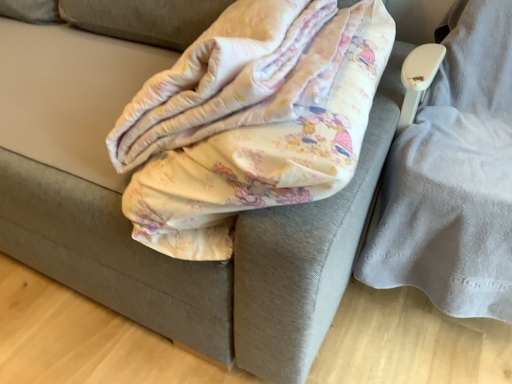
Question: Considering the relative positions of gray fabric swivel chair at right and fluffy cotton blanket at center in the image provided, is gray fabric swivel chair at right to the left of fluffy cotton blanket at center from the viewer's perspective?

Choices:
 (A) no
 (B) yes

Answer: (A)

Question: From the image's perspective, does gray fabric swivel chair at right appear lower than fluffy cotton blanket at center?

Choices:
 (A) no
 (B) yes

Answer: (B)

Question: Is gray fabric swivel chair at right at the right side of fluffy cotton blanket at center?

Choices:
 (A) no
 (B) yes

Answer: (B)

Question: From a real-world perspective, is gray fabric swivel chair at right beneath fluffy cotton blanket at center?

Choices:
 (A) yes
 (B) no

Answer: (A)

Question: Is gray fabric swivel chair at right thinner than fluffy cotton blanket at center?

Choices:
 (A) yes
 (B) no

Answer: (A)

Question: From a real-world perspective, is gray fabric swivel chair at right positioned over fluffy cotton blanket at center based on gravity?

Choices:
 (A) yes
 (B) no

Answer: (B)

Question: Is fluffy cotton blanket at center bigger than gray fabric swivel chair at right?

Choices:
 (A) yes
 (B) no

Answer: (B)

Question: Is fluffy cotton blanket at center not within gray fabric swivel chair at right?

Choices:
 (A) no
 (B) yes

Answer: (B)

Question: Considering the relative sizes of fluffy cotton blanket at center and gray fabric swivel chair at right in the image provided, is fluffy cotton blanket at center thinner than gray fabric swivel chair at right?

Choices:
 (A) no
 (B) yes

Answer: (A)

Question: Would you say gray fabric swivel chair at right is part of fluffy cotton blanket at center's contents?

Choices:
 (A) yes
 (B) no

Answer: (B)

Question: Is there a large distance between fluffy cotton blanket at center and gray fabric swivel chair at right?

Choices:
 (A) no
 (B) yes

Answer: (A)

Question: Is fluffy cotton blanket at center turned away from gray fabric swivel chair at right?

Choices:
 (A) no
 (B) yes

Answer: (A)

Question: Considering the positions of gray fabric swivel chair at right and fluffy cotton blanket at center in the image, is gray fabric swivel chair at right bigger or smaller than fluffy cotton blanket at center?

Choices:
 (A) big
 (B) small

Answer: (A)